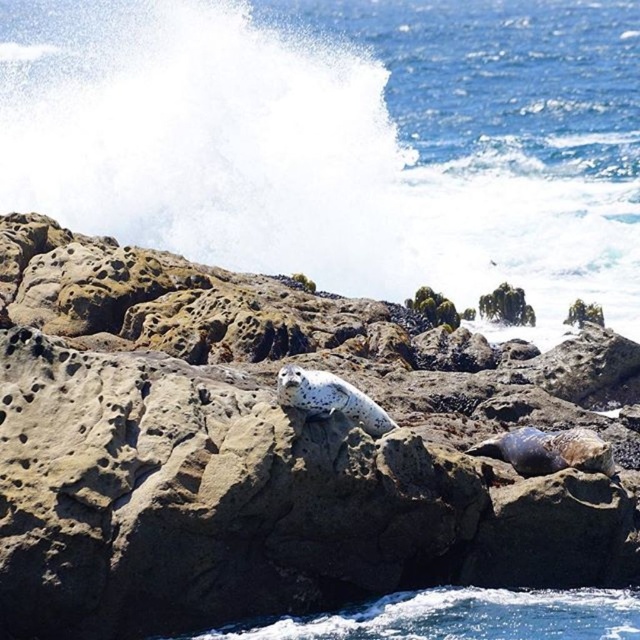
Can you confirm if speckled gray rock at center is shorter than blue water at upper center?

Answer: Yes.

Can you confirm if speckled gray rock at center is positioned below blue water at upper center?

Indeed, speckled gray rock at center is positioned under blue water at upper center.

What do you see at coordinates (269, 449) in the screenshot? This screenshot has width=640, height=640. I see `speckled gray rock at center` at bounding box center [269, 449].

Where is `speckled gray rock at center`? Image resolution: width=640 pixels, height=640 pixels. speckled gray rock at center is located at coordinates click(x=269, y=449).